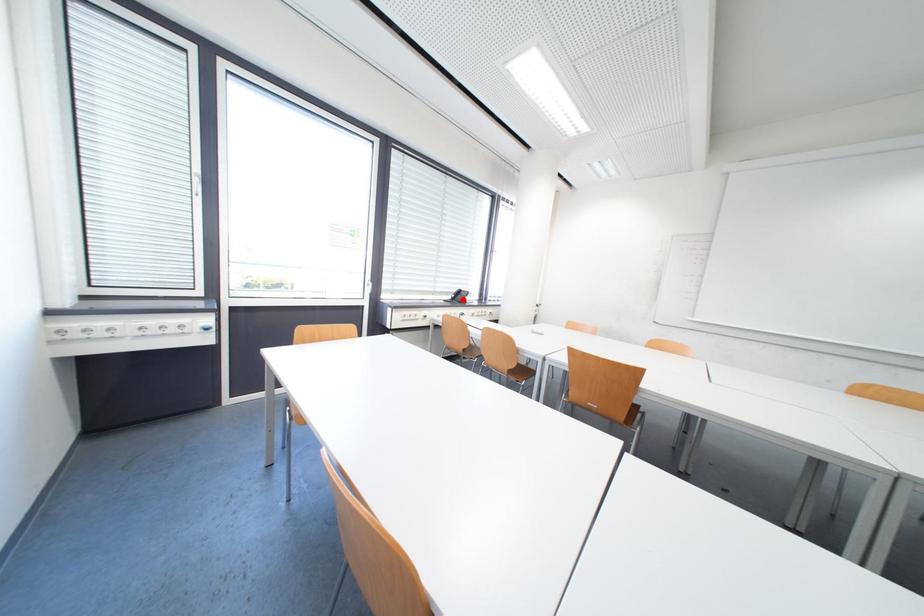
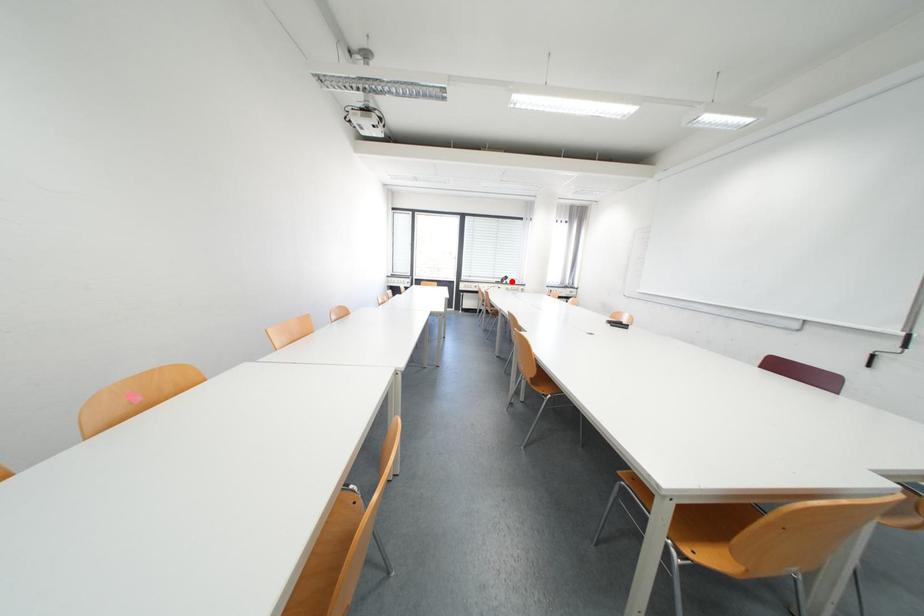
I am providing you with two images of the same scene from different viewpoints. A red point is marked on the first image and another point is marked on the second image. Is the marked point in image1 the same physical position as the marked point in image2?

Yes